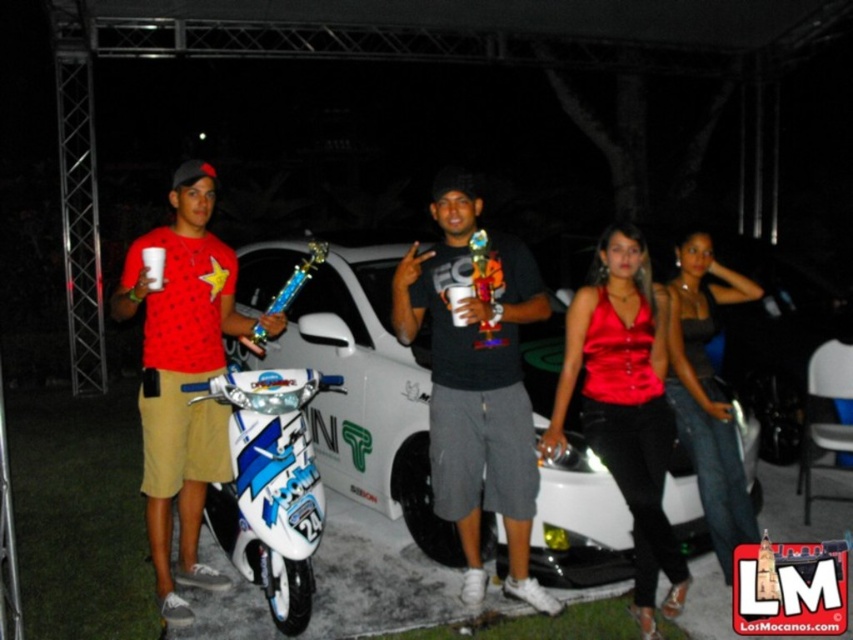
Is point (187, 195) in front of point (746, 292)?

Yes.

Between point (132, 252) and point (729, 544), which one is positioned in front?

Point (132, 252)

The width and height of the screenshot is (853, 640). Describe the element at coordinates (184, 376) in the screenshot. I see `matte red t-shirt at center` at that location.

Where is `matte red t-shirt at center`? The width and height of the screenshot is (853, 640). matte red t-shirt at center is located at coordinates (184, 376).

Which of these two, shiny satin top at center or denim jeans at center, stands shorter?

denim jeans at center is shorter.

Does shiny satin top at center have a larger size compared to denim jeans at center?

Incorrect, shiny satin top at center is not larger than denim jeans at center.

Does point (625, 259) come in front of point (697, 340)?

Yes.

You are a GUI agent. You are given a task and a screenshot of the screen. Output one action in this format:
    pyautogui.click(x=<x>, y=<y>)
    Task: Click on the shiny satin top at center
    
    Given the screenshot: What is the action you would take?
    pos(625,404)

Which is below, white glossy scooter at center or white glossy motorcycle at center?

white glossy motorcycle at center is below.

Is white glossy scooter at center thinner than white glossy motorcycle at center?

In fact, white glossy scooter at center might be wider than white glossy motorcycle at center.

You are a GUI agent. You are given a task and a screenshot of the screen. Output one action in this format:
    pyautogui.click(x=<x>, y=<y>)
    Task: Click on the white glossy scooter at center
    This screenshot has width=853, height=640.
    Given the screenshot: What is the action you would take?
    364,392